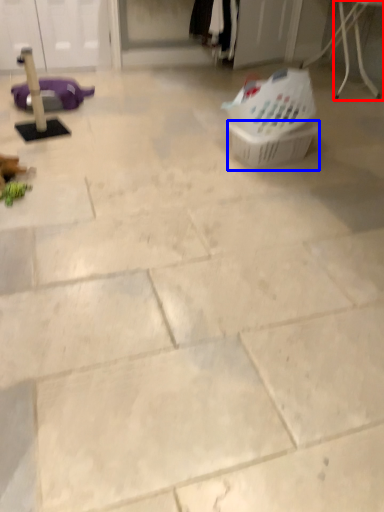
Question: Which object is further to the camera taking this photo, furniture (highlighted by a red box) or basket (highlighted by a blue box)?

Choices:
 (A) furniture
 (B) basket

Answer: (A)